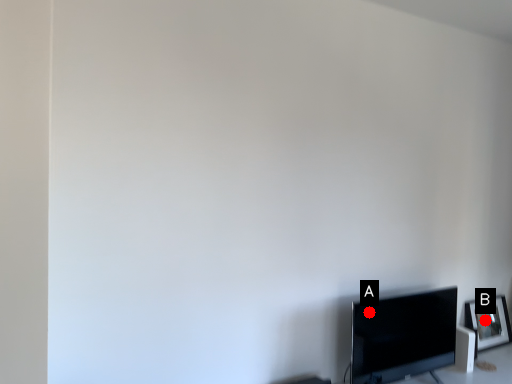
Question: Two points are circled on the image, labeled by A and B beside each circle. Which of the following is the closest to the observer?

Choices:
 (A) A is closer
 (B) B is closer

Answer: (A)